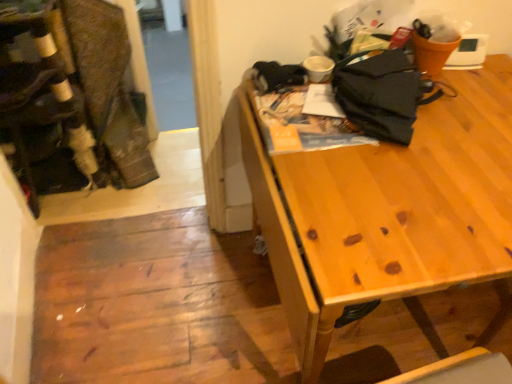
Question: From the image's perspective, is velvet-like fabric at left on top of black fabric umbrella at upper right?

Choices:
 (A) no
 (B) yes

Answer: (B)

Question: Is velvet-like fabric at left positioned before black fabric umbrella at upper right?

Choices:
 (A) no
 (B) yes

Answer: (A)

Question: Does velvet-like fabric at left appear on the left side of black fabric umbrella at upper right?

Choices:
 (A) yes
 (B) no

Answer: (A)

Question: Is velvet-like fabric at left bigger than black fabric umbrella at upper right?

Choices:
 (A) no
 (B) yes

Answer: (B)

Question: Is there a large distance between velvet-like fabric at left and black fabric umbrella at upper right?

Choices:
 (A) yes
 (B) no

Answer: (A)

Question: Considering the positions of velvet-like fabric at left and black fabric umbrella at upper right in the image, is velvet-like fabric at left wider or thinner than black fabric umbrella at upper right?

Choices:
 (A) thin
 (B) wide

Answer: (B)

Question: Does point (18, 109) appear closer or farther from the camera than point (401, 115)?

Choices:
 (A) farther
 (B) closer

Answer: (A)

Question: In the image, is velvet-like fabric at left on the left side or the right side of black fabric umbrella at upper right?

Choices:
 (A) right
 (B) left

Answer: (B)

Question: From the image's perspective, is velvet-like fabric at left positioned above or below black fabric umbrella at upper right?

Choices:
 (A) below
 (B) above

Answer: (B)

Question: From the image's perspective, is wooden table at upper right located above or below black fabric umbrella at upper right?

Choices:
 (A) below
 (B) above

Answer: (A)

Question: From their relative heights in the image, would you say wooden table at upper right is taller or shorter than black fabric umbrella at upper right?

Choices:
 (A) short
 (B) tall

Answer: (B)

Question: In terms of width, does wooden table at upper right look wider or thinner when compared to black fabric umbrella at upper right?

Choices:
 (A) thin
 (B) wide

Answer: (B)

Question: From a real-world perspective, is wooden table at upper right above or below black fabric umbrella at upper right?

Choices:
 (A) above
 (B) below

Answer: (B)

Question: Is brown textured fabric laundry at left inside the boundaries of black fabric umbrella at upper right, or outside?

Choices:
 (A) inside
 (B) outside

Answer: (B)

Question: Is point (77, 49) closer or farther from the camera than point (375, 56)?

Choices:
 (A) farther
 (B) closer

Answer: (A)